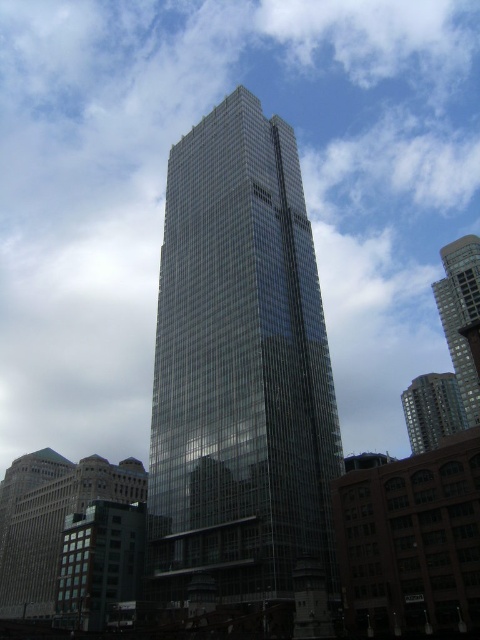
Question: Can you confirm if transparent glass skyscraper at center is positioned below glassy skyscraper at center?

Choices:
 (A) yes
 (B) no

Answer: (A)

Question: Which point is closer to the camera?

Choices:
 (A) (157, 413)
 (B) (416, 429)

Answer: (A)

Question: Which object is farther from the camera taking this photo?

Choices:
 (A) glassy reflective building at right
 (B) transparent glass skyscraper at center

Answer: (A)

Question: Does glassy skyscraper at center have a smaller size compared to glassy reflective building at right?

Choices:
 (A) yes
 (B) no

Answer: (B)

Question: Can you confirm if transparent glass skyscraper at center is bigger than glassy reflective building at right?

Choices:
 (A) yes
 (B) no

Answer: (A)

Question: Based on their relative distances, which object is nearer to the transparent glass skyscraper at center?

Choices:
 (A) glassy reflective building at right
 (B) glassy skyscraper at center

Answer: (B)